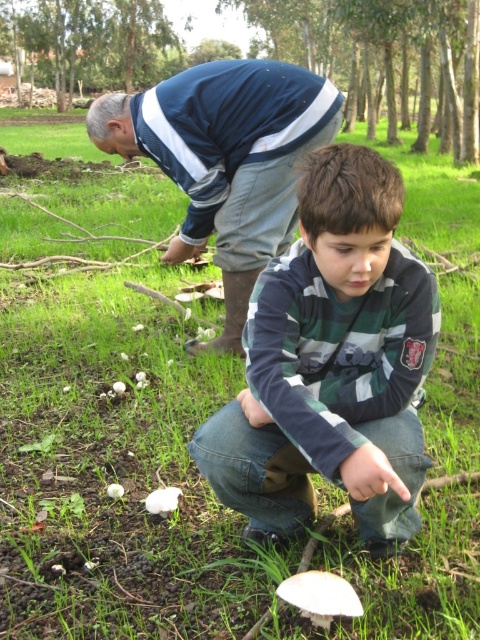
Question: Can you confirm if green striped sweater at center is thinner than blue striped sweater at upper center?

Choices:
 (A) yes
 (B) no

Answer: (A)

Question: Can you confirm if green striped sweater at center is thinner than blue striped sweater at upper center?

Choices:
 (A) yes
 (B) no

Answer: (A)

Question: Among these points, which one is nearest to the camera?

Choices:
 (A) (271, 76)
 (B) (297, 275)

Answer: (B)

Question: Which of the following is the farthest from the observer?

Choices:
 (A) green striped sweater at center
 (B) blue striped sweater at upper center

Answer: (B)

Question: Does green striped sweater at center appear over blue striped sweater at upper center?

Choices:
 (A) yes
 (B) no

Answer: (B)

Question: Which point is farther to the camera?

Choices:
 (A) blue striped sweater at upper center
 (B) green striped sweater at center

Answer: (A)